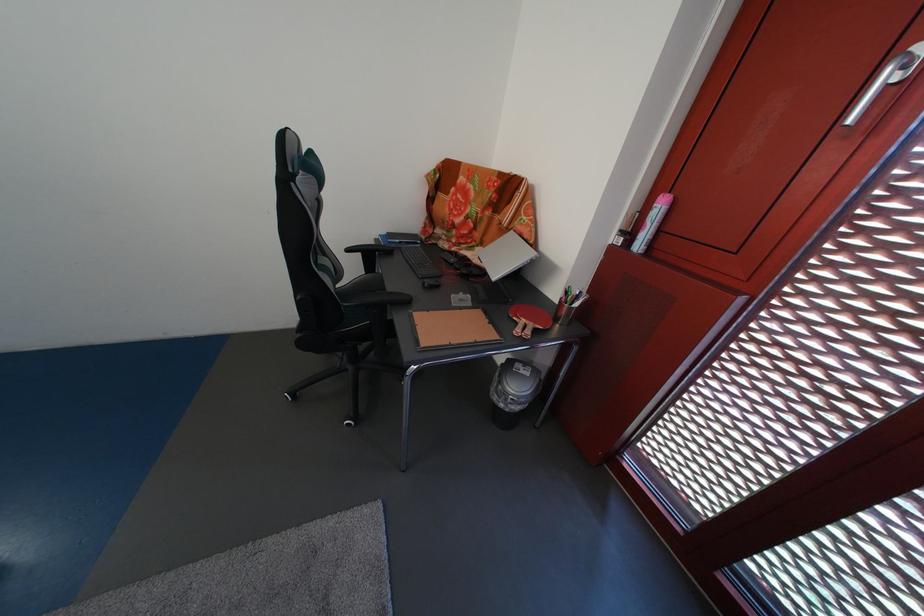
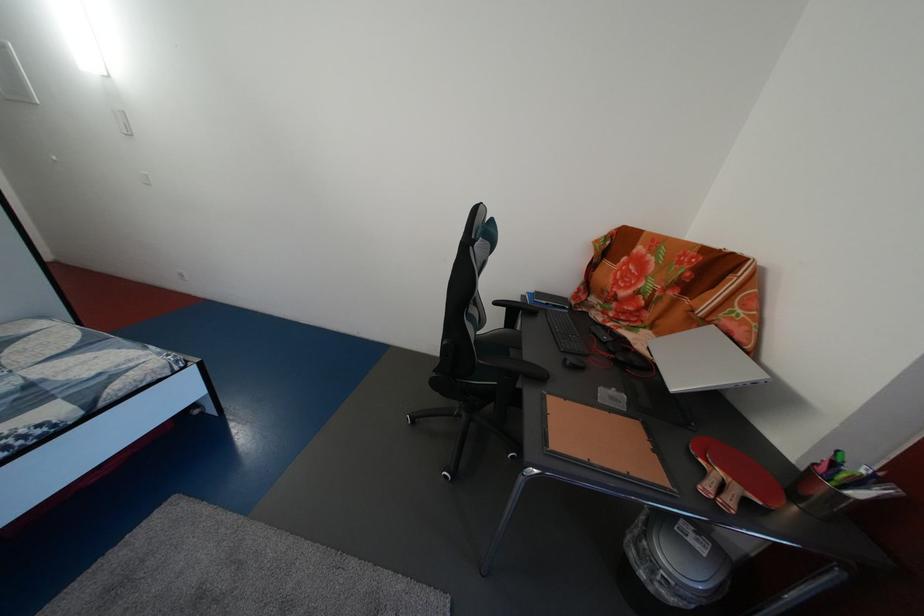
In the second image, find the point that corresponds to (434,290) in the first image.

(576, 367)